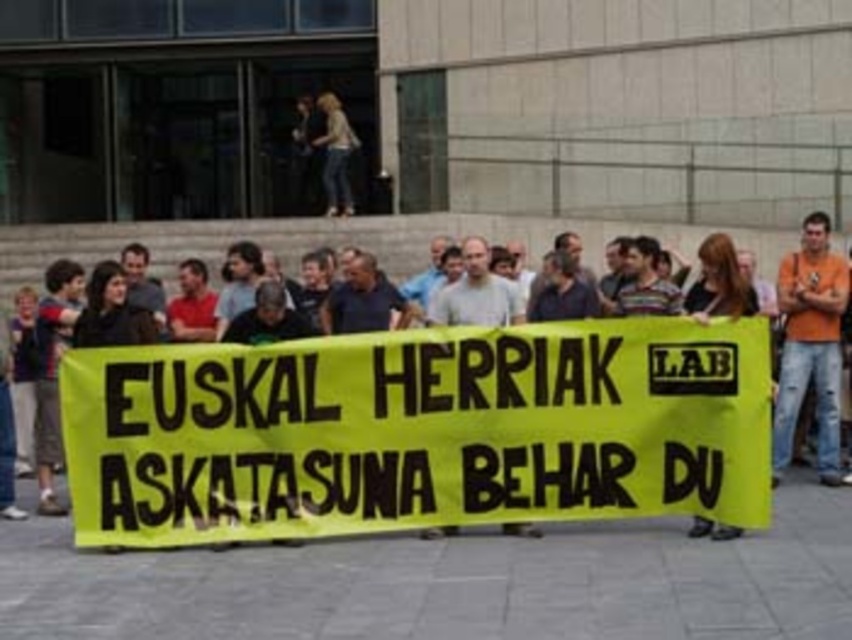
Question: Which object is positioned closest to the orange cotton shirt at right?

Choices:
 (A) matte black shirt at center
 (B) yellow fabric banner at center

Answer: (B)

Question: Can you confirm if yellow fabric banner at center is bigger than orange cotton shirt at right?

Choices:
 (A) yes
 (B) no

Answer: (A)

Question: Is yellow fabric banner at center above matte black shirt at center?

Choices:
 (A) yes
 (B) no

Answer: (A)

Question: Which point is closer to the camera?

Choices:
 (A) (464, 291)
 (B) (802, 232)

Answer: (A)

Question: Which of the following is the closest to the observer?

Choices:
 (A) orange cotton shirt at right
 (B) yellow fabric banner at center
 (C) matte black shirt at center

Answer: (B)

Question: Can you confirm if yellow fabric banner at center is positioned to the right of matte black shirt at center?

Choices:
 (A) no
 (B) yes

Answer: (A)